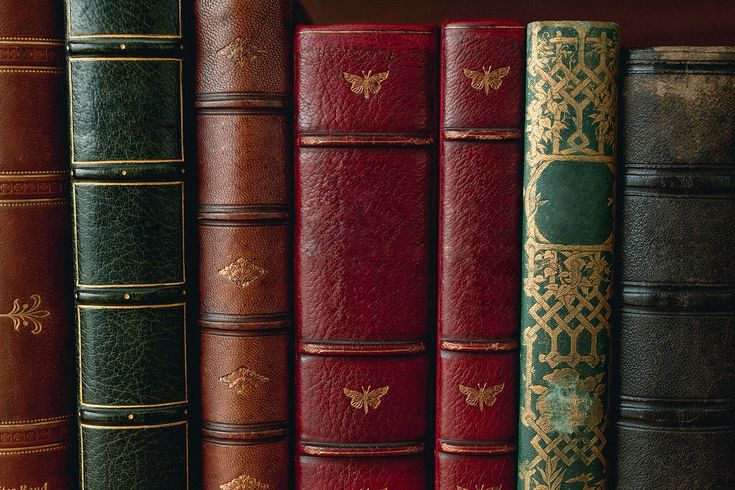
Image resolution: width=735 pixels, height=490 pixels. Identify the location of book. [x=20, y=325], [x=107, y=329], [x=229, y=311], [x=359, y=271], [x=478, y=255], [x=553, y=245], [x=681, y=262].